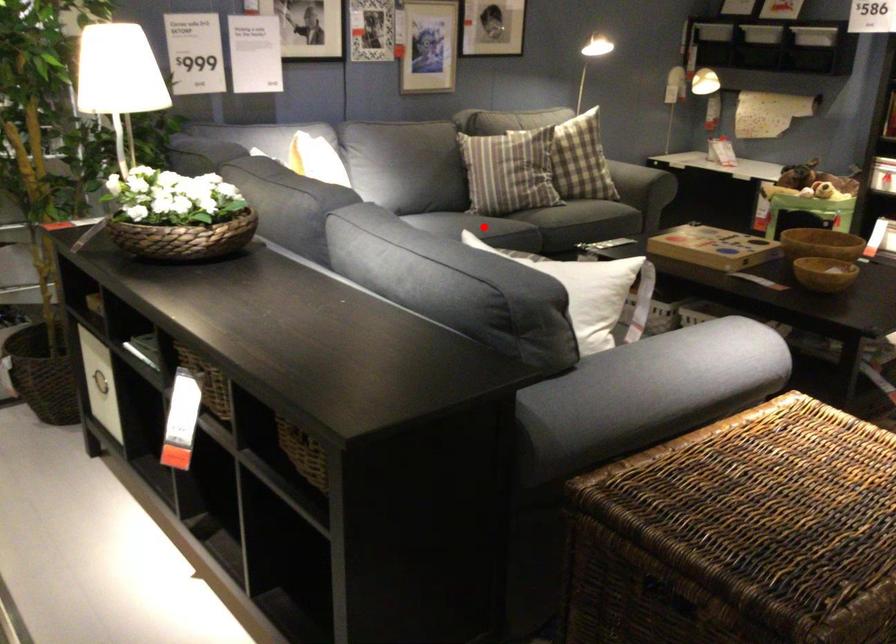
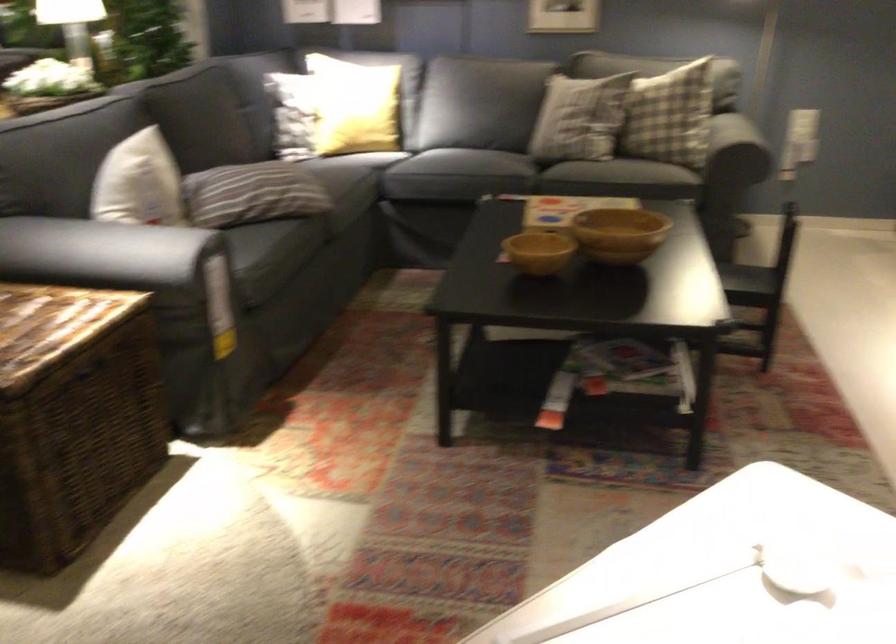
Question: I am providing you with two images of the same scene from different viewpoints. A red point is marked on the first image. Is the red point's position out of view in image 2?

Choices:
 (A) Yes
 (B) No

Answer: (A)